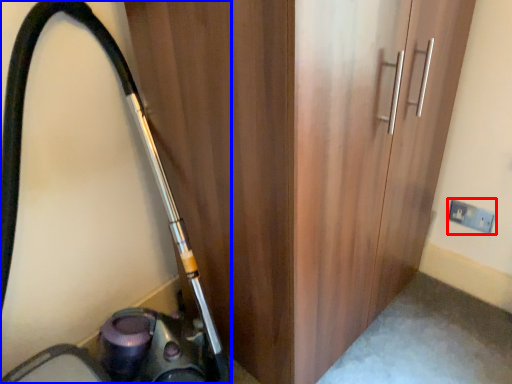
Question: Which of the following is the farthest to the observer, electric outlet (highlighted by a red box) or equipment (highlighted by a blue box)?

Choices:
 (A) electric outlet
 (B) equipment

Answer: (A)